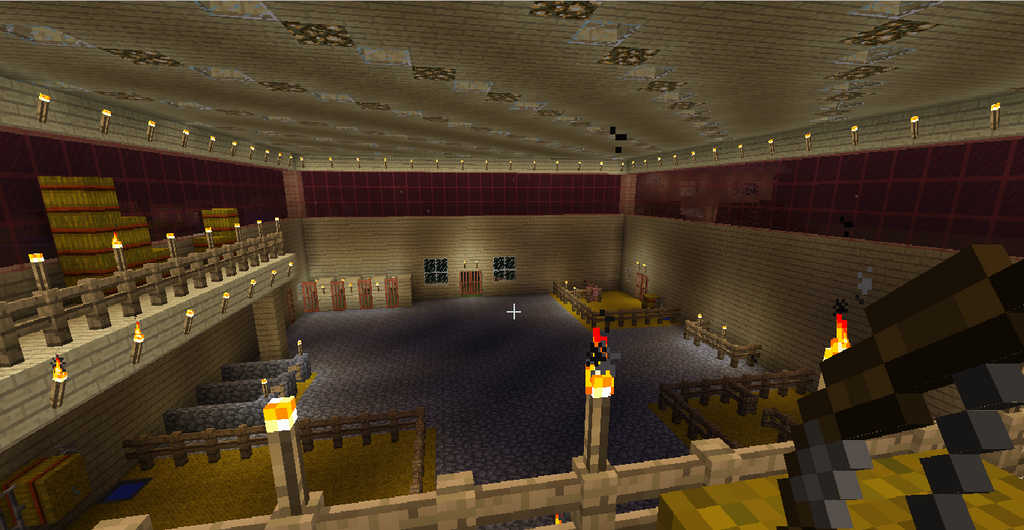
Identify the location of left wall. (157, 192).